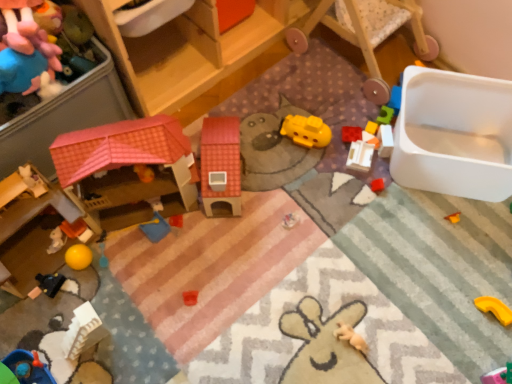
At what (x,y) coordinates should I click in order to perform the action: click on vacant space in front of yellow matte submarine at center, the 7th toy when ordered from right to left. Please return your answer as a coordinate pair (x, y). This screenshot has width=512, height=384. Looking at the image, I should click on (311, 181).